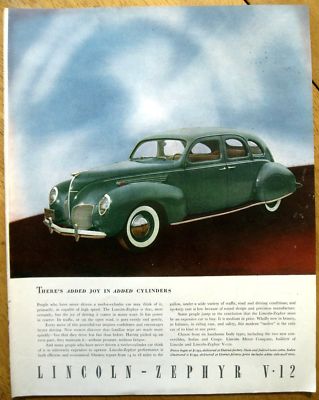
Identify the location of door. (206, 173).